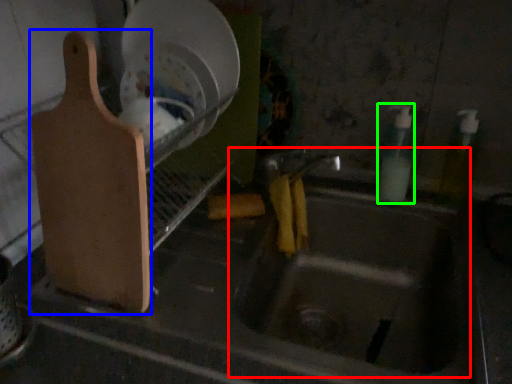
Question: Estimate the real-world distances between objects in this image. Which object is farther from sink (highlighted by a red box), cutting board (highlighted by a blue box) or bottle (highlighted by a green box)?

Choices:
 (A) cutting board
 (B) bottle

Answer: (A)